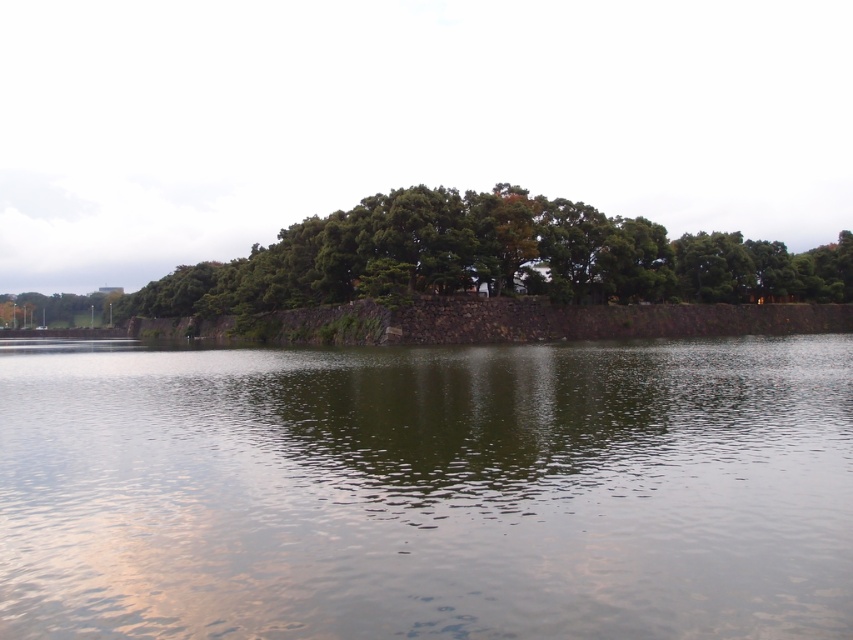
Question: Can you confirm if green reflective water at center is positioned to the left of green leafy tree at center?

Choices:
 (A) yes
 (B) no

Answer: (B)

Question: Which object appears closest to the camera in this image?

Choices:
 (A) green leafy tree at center
 (B) green reflective water at center

Answer: (B)

Question: Which point is farther from the camera taking this photo?

Choices:
 (A) (701, 259)
 (B) (271, 566)

Answer: (A)

Question: Does green reflective water at center have a greater width compared to green leafy tree at center?

Choices:
 (A) yes
 (B) no

Answer: (B)

Question: Can you confirm if green reflective water at center is thinner than green leafy tree at center?

Choices:
 (A) yes
 (B) no

Answer: (A)